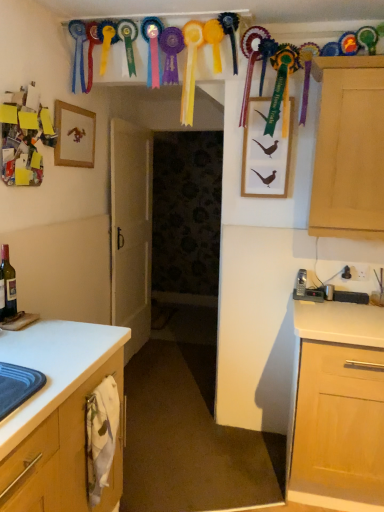
Question: Is matte glass bottle at left bigger than light wood cabinet at right?

Choices:
 (A) yes
 (B) no

Answer: (B)

Question: Is matte glass bottle at left looking in the opposite direction of light wood cabinet at right?

Choices:
 (A) no
 (B) yes

Answer: (A)

Question: From a real-world perspective, is matte glass bottle at left under light wood cabinet at right?

Choices:
 (A) no
 (B) yes

Answer: (B)

Question: Is matte glass bottle at left directly adjacent to light wood cabinet at right?

Choices:
 (A) no
 (B) yes

Answer: (A)

Question: From a real-world perspective, is matte glass bottle at left positioned over light wood cabinet at right based on gravity?

Choices:
 (A) yes
 (B) no

Answer: (B)

Question: Is point (291, 139) positioned closer to the camera than point (329, 157)?

Choices:
 (A) farther
 (B) closer

Answer: (A)

Question: From a real-world perspective, is wooden framed picture of birds at upper center, placed as the second picture frame when sorted from left to right, positioned above or below light wood cabinet at right?

Choices:
 (A) below
 (B) above

Answer: (B)

Question: From their relative heights in the image, would you say wooden framed picture of birds at upper center, arranged as the 1th picture frame when viewed from the right, is taller or shorter than light wood cabinet at right?

Choices:
 (A) tall
 (B) short

Answer: (B)

Question: Considering the positions of wooden framed picture of birds at upper center, placed as the second picture frame when sorted from left to right, and light wood cabinet at right in the image, is wooden framed picture of birds at upper center, placed as the second picture frame when sorted from left to right, bigger or smaller than light wood cabinet at right?

Choices:
 (A) small
 (B) big

Answer: (A)

Question: Is wooden framed picture of birds at upper center, arranged as the 1th picture frame when viewed from the right, bigger or smaller than white matte door at center?

Choices:
 (A) big
 (B) small

Answer: (B)

Question: In the image, is wooden framed picture of birds at upper center, arranged as the 1th picture frame when viewed from the right, on the left side or the right side of white matte door at center?

Choices:
 (A) left
 (B) right

Answer: (B)

Question: Relative to white matte door at center, is wooden framed picture of birds at upper center, arranged as the 1th picture frame when viewed from the right, in front or behind?

Choices:
 (A) front
 (B) behind

Answer: (A)

Question: From a real-world perspective, relative to white matte door at center, is wooden framed picture of birds at upper center, arranged as the 1th picture frame when viewed from the right, vertically above or below?

Choices:
 (A) above
 (B) below

Answer: (A)

Question: Is wooden picture frame at upper left, the 2th picture frame from the right, wider or thinner than wooden framed picture of birds at upper center, placed as the second picture frame when sorted from left to right?

Choices:
 (A) thin
 (B) wide

Answer: (A)

Question: Considering the positions of wooden picture frame at upper left, the 2th picture frame from the right, and wooden framed picture of birds at upper center, placed as the second picture frame when sorted from left to right, in the image, is wooden picture frame at upper left, the 2th picture frame from the right, bigger or smaller than wooden framed picture of birds at upper center, placed as the second picture frame when sorted from left to right,?

Choices:
 (A) big
 (B) small

Answer: (B)